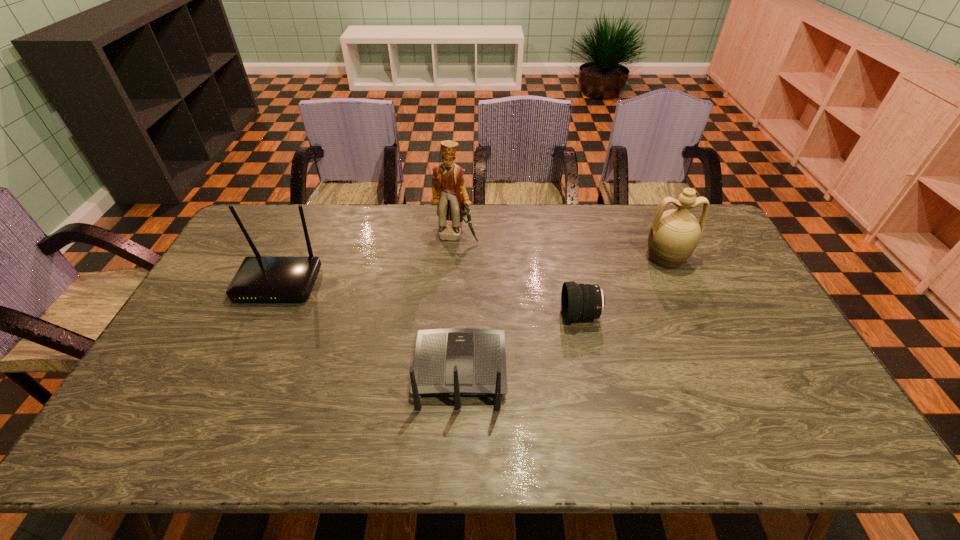
Find the location of a particular element. This screenshot has height=540, width=960. nutcracker is located at coordinates (448, 188).

What are the coordinates of `pitcher` in the screenshot? It's located at (674, 234).

The image size is (960, 540). Find the location of `the taller router`. the taller router is located at coordinates (259, 278).

The width and height of the screenshot is (960, 540). What are the coordinates of `the left router` in the screenshot? It's located at (259, 278).

Find the location of a particular element. the shorter router is located at coordinates (x=456, y=362).

I want to click on the nearer router, so click(x=456, y=362).

The image size is (960, 540). I want to click on the fourth object from left to right, so click(x=578, y=301).

The image size is (960, 540). In order to click on telephoto lens in this screenshot , I will do `click(578, 301)`.

Identify the location of vacant space located 0.350m on the front-facing side of the tallest object. (451, 321).

The width and height of the screenshot is (960, 540). I want to click on vacant space located 0.370m on the left of the rightmost object, so click(531, 258).